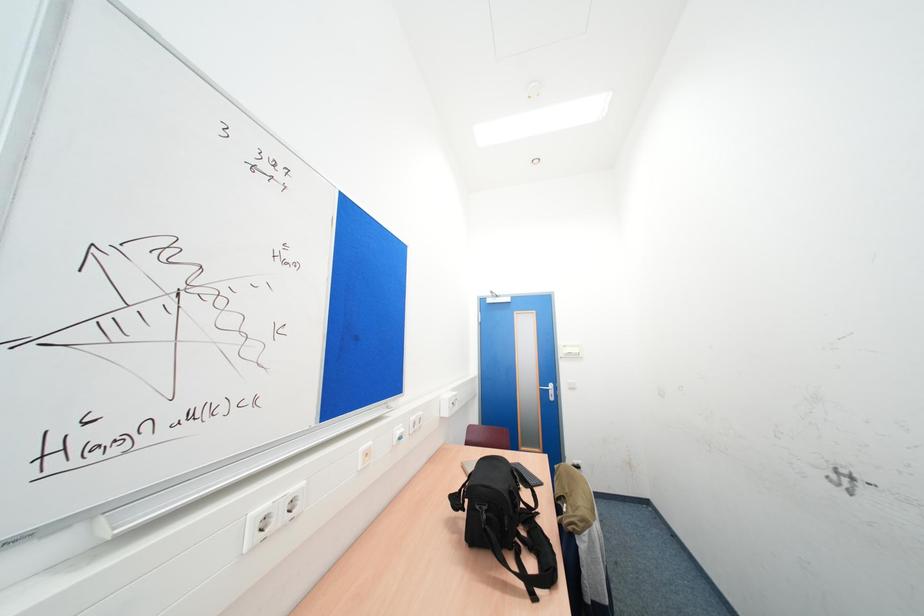
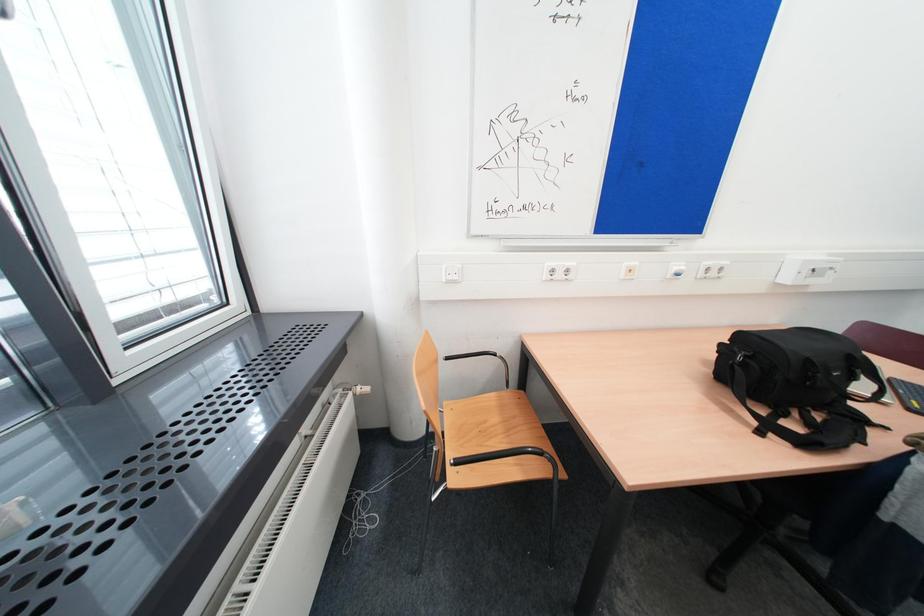
Based on the photo, first-person continuous shooting, in which direction is the camera rotating?

The rotation direction of the camera is left-down.